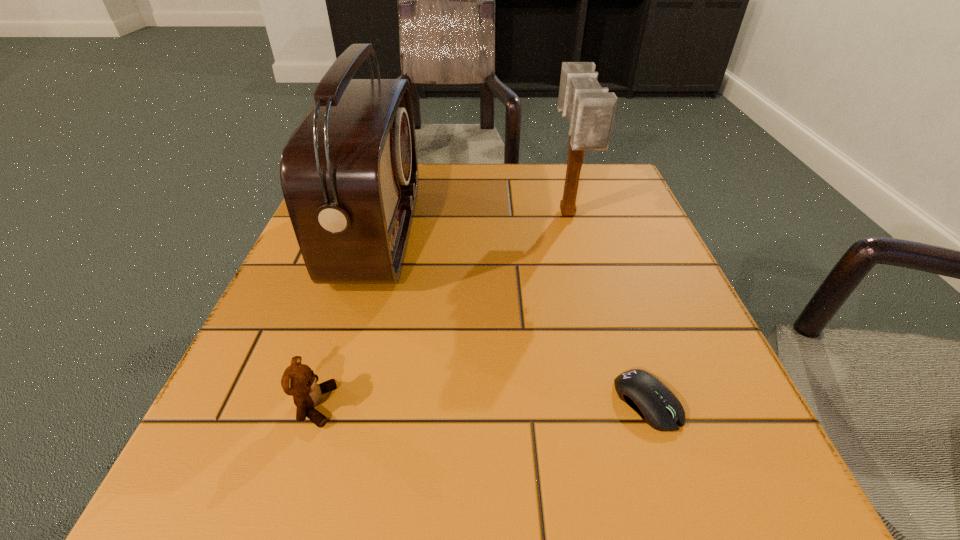
Where is `radio receiver`? radio receiver is located at coordinates (349, 174).

Where is `the third shortest object`? Image resolution: width=960 pixels, height=540 pixels. the third shortest object is located at coordinates (590, 109).

This screenshot has width=960, height=540. What are the coordinates of `teddy bear` in the screenshot? It's located at (298, 380).

This screenshot has height=540, width=960. Identify the location of computer equipment. (657, 406).

Image resolution: width=960 pixels, height=540 pixels. Find the location of `free space located on the front panel of the tallest object`. free space located on the front panel of the tallest object is located at coordinates (588, 233).

Where is `free location located 0.160m on the front of the second tallest object`? This screenshot has height=540, width=960. free location located 0.160m on the front of the second tallest object is located at coordinates (590, 301).

At what (x,y) coordinates should I click in order to perform the action: click on vacant space located 0.370m on the front-facing side of the teddy bear. Please return your answer as a coordinate pair (x, y). The image size is (960, 540). Looking at the image, I should click on (608, 406).

This screenshot has width=960, height=540. I want to click on free region located on the left of the shortest object, so click(x=331, y=402).

Identify the location of radio receiver that is positioned at the far edge. The height and width of the screenshot is (540, 960). (349, 174).

The width and height of the screenshot is (960, 540). What are the coordinates of `mallet that is at the far edge` in the screenshot? It's located at (590, 109).